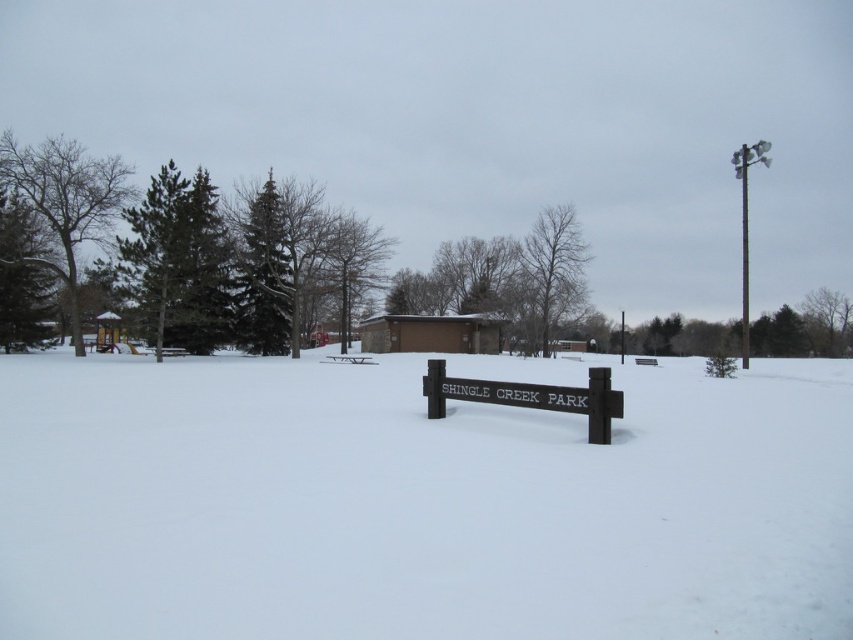
You are standing at the point marked by the coordinates point [347,262] in Shingle Creek Park. What can you see directly in front of you?

At point [347,262] lies green textured tree at center.

You are a hiker who wants to walk from the bare wood tree at left to the green leafy tree at right. Which direction should you move towards?

You should move towards the right direction to reach the green leafy tree at right from the bare wood tree at left since the bare wood tree at left is positioned on the left side of green leafy tree at right.